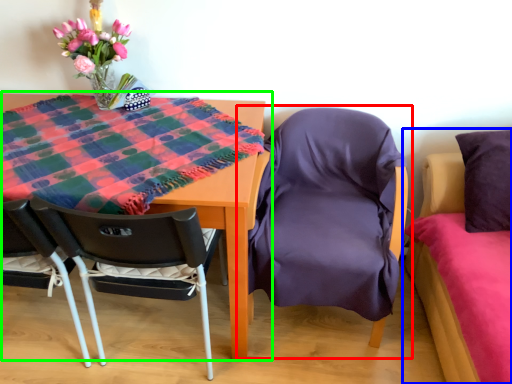
Question: Which is farther away from chair (highlighted by a red box)? bed (highlighted by a blue box) or table (highlighted by a green box)?

Choices:
 (A) bed
 (B) table

Answer: (B)